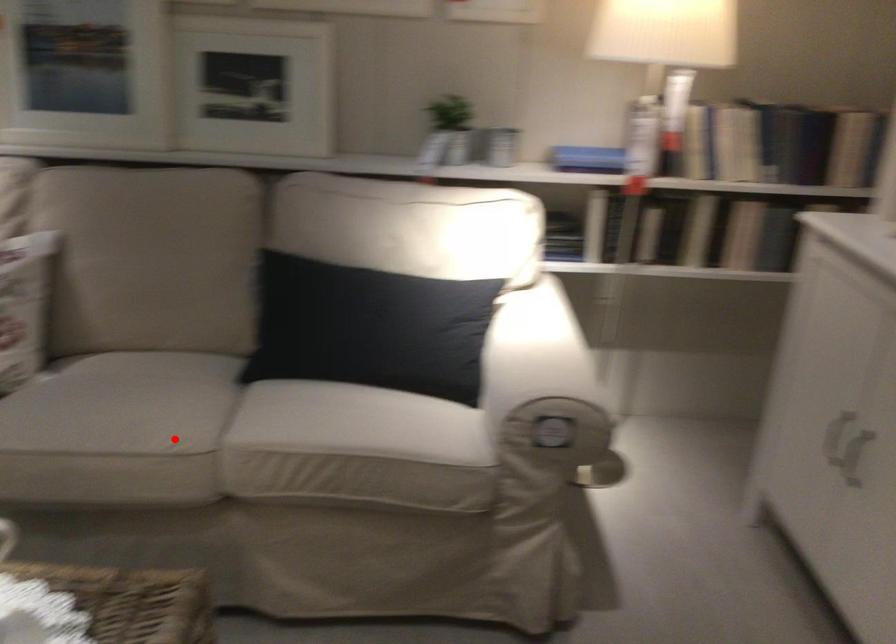
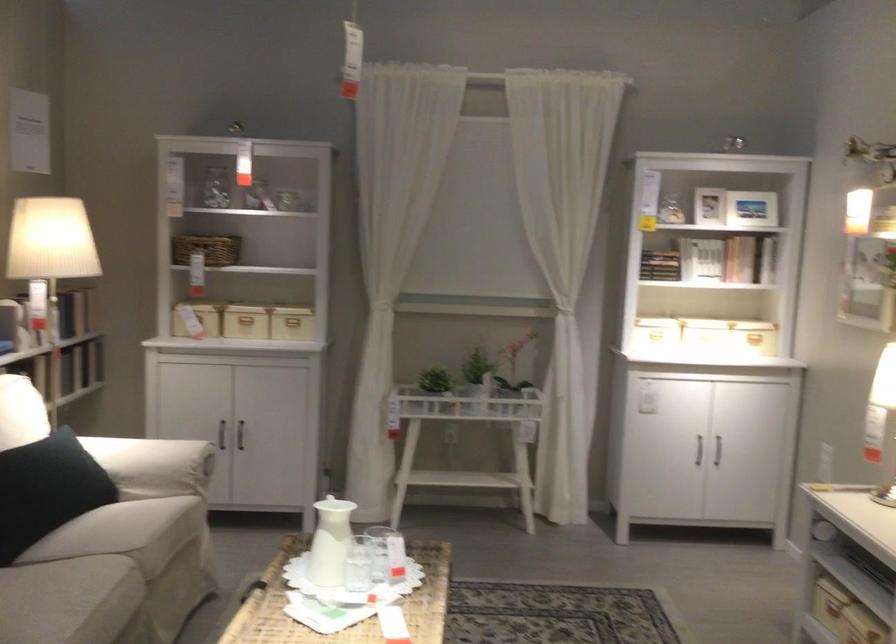
Locate, in the second image, the point that corresponds to the highlighted location in the first image.

(110, 576)